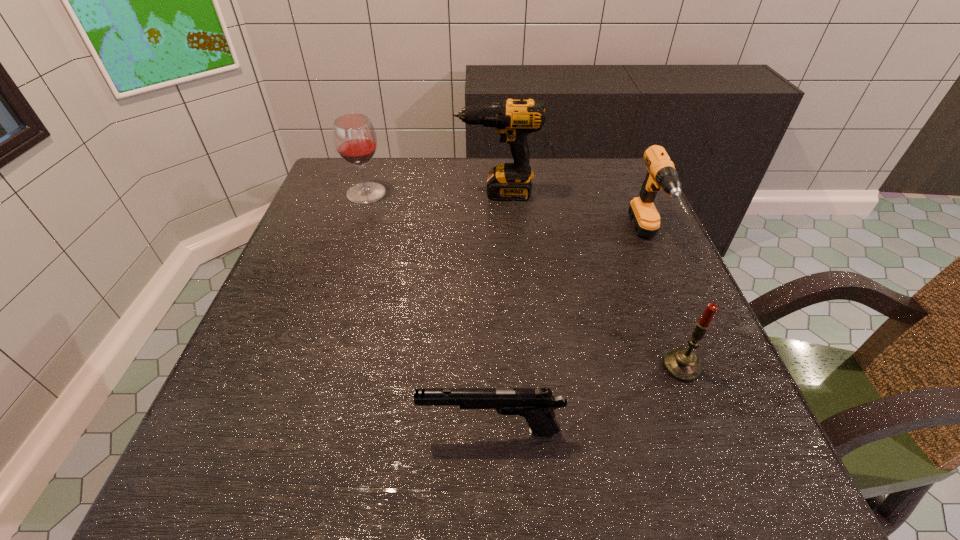
The height and width of the screenshot is (540, 960). Identify the location of the farther drill. (513, 119).

Locate an element on the screen. the tallest object is located at coordinates (513, 119).

Find the location of a particular element. wineglass is located at coordinates (355, 140).

Locate an element on the screen. This screenshot has width=960, height=540. the shorter drill is located at coordinates (661, 174).

Where is `the right drill`? the right drill is located at coordinates (661, 174).

Locate an element on the screen. candle is located at coordinates (682, 364).

Locate an element on the screen. This screenshot has width=960, height=540. the second shortest object is located at coordinates (682, 364).

In order to click on the shortest object in this screenshot , I will do `click(537, 405)`.

You are a GUI agent. You are given a task and a screenshot of the screen. Output one action in this format:
    pyautogui.click(x=<x>, y=<y>)
    Task: Click on the nearest object
    
    Given the screenshot: What is the action you would take?
    pyautogui.click(x=537, y=405)

Image resolution: width=960 pixels, height=540 pixels. What are the coordinates of `blank space located at the tip of the left drill` in the screenshot? It's located at (429, 193).